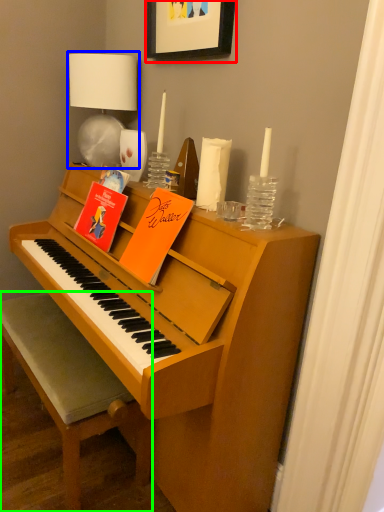
Question: Based on their relative distances, which object is nearer to picture frame (highlighted by a red box)? Choose from table lamp (highlighted by a blue box) and chair (highlighted by a green box).

Choices:
 (A) table lamp
 (B) chair

Answer: (A)